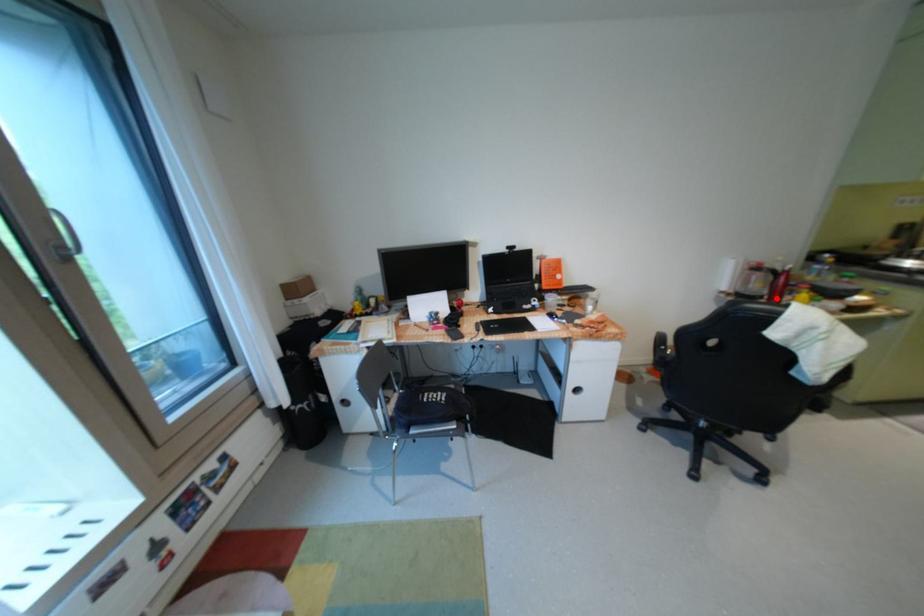
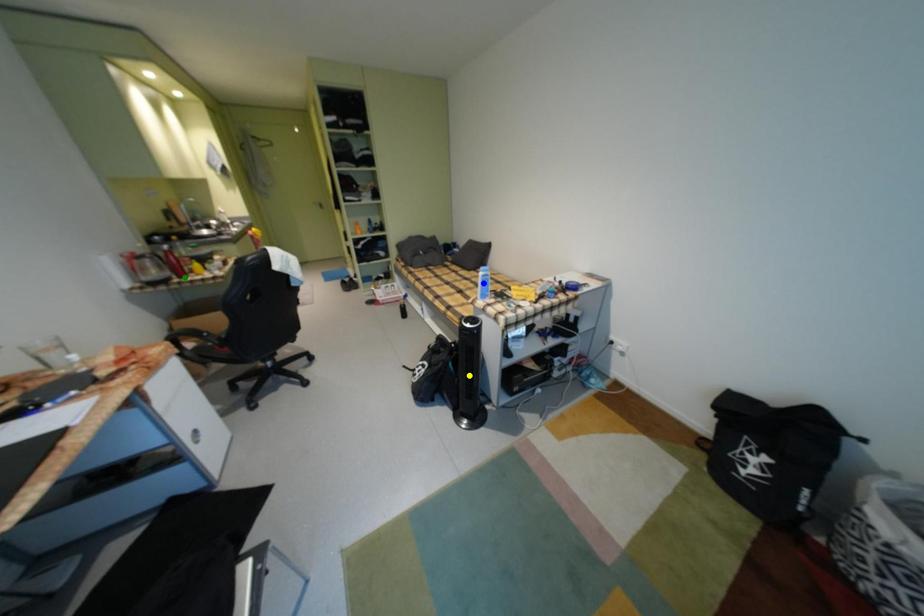
Question: I am providing you with two images of the same scene from different viewpoints. A red point is marked on the first image. You are given multiple points on the second image. Which spot in image 2 lines up with the point in image 1?

Choices:
 (A) green point
 (B) yellow point
 (C) blue point

Answer: (A)